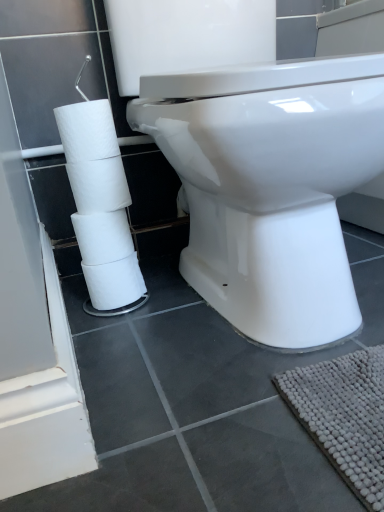
At what (x,y) coordinates should I click in order to perform the action: click on white glossy toilet at center. Please return your answer as a coordinate pair (x, y). Looking at the image, I should click on (271, 187).

The height and width of the screenshot is (512, 384). Describe the element at coordinates (271, 187) in the screenshot. I see `white glossy toilet at center` at that location.

Describe the element at coordinates (100, 205) in the screenshot. I see `white matte toilet paper at left` at that location.

Find the location of a particular element. This screenshot has width=384, height=512. white matte toilet paper at left is located at coordinates (100, 205).

What are the coordinates of `white glossy toilet at center` in the screenshot? It's located at (271, 187).

Which object is positioned more to the left, white glossy toilet at center or white matte toilet paper at left?

white matte toilet paper at left is more to the left.

In the image, is white glossy toilet at center positioned in front of or behind white matte toilet paper at left?

In the image, white glossy toilet at center appears in front of white matte toilet paper at left.

Is point (267, 111) positioned behind point (64, 118)?

That is False.

From the image's perspective, is white glossy toilet at center on white matte toilet paper at left?

Yes, from the image's perspective, white glossy toilet at center is above white matte toilet paper at left.

From a real-world perspective, which is physically above, white glossy toilet at center or white matte toilet paper at left?

In real-world perspective, white glossy toilet at center is above.

Which object is thinner, white glossy toilet at center or white matte toilet paper at left?

With smaller width is white matte toilet paper at left.

Between white glossy toilet at center and white matte toilet paper at left, which one has more height?

With more height is white glossy toilet at center.

Between white glossy toilet at center and white matte toilet paper at left, which one has smaller size?

white matte toilet paper at left.

From the picture: Is white glossy toilet at center not within white matte toilet paper at left?

Yes, white glossy toilet at center is located beyond the bounds of white matte toilet paper at left.

Does white glossy toilet at center touch white matte toilet paper at left?

No, white glossy toilet at center is not making contact with white matte toilet paper at left.

Is white glossy toilet at center positioned with its back to white matte toilet paper at left?

That's not correct — white glossy toilet at center is not looking away from white matte toilet paper at left.

How different are the orientations of white glossy toilet at center and white matte toilet paper at left in degrees?

There is a 2.61-degree angle between the facing directions of white glossy toilet at center and white matte toilet paper at left.

Identify the location of toilet paper that is below the white glossy toilet at center (from the image's perspective). This screenshot has height=512, width=384. (100, 205).

Which is more to the left, white matte toilet paper at left or white glossy toilet at center?

white matte toilet paper at left.

Is the position of white matte toilet paper at left more distant than that of white glossy toilet at center?

Yes, it is behind white glossy toilet at center.

Considering the points (124, 298) and (207, 116), which point is behind, point (124, 298) or point (207, 116)?

The point (124, 298) is more distant.

Looking at this image, from the image's perspective, is white matte toilet paper at left located above or below white glossy toilet at center?

Clearly, from the image's perspective, white matte toilet paper at left is below white glossy toilet at center.

From a real-world perspective, which is physically below, white matte toilet paper at left or white glossy toilet at center?

From a 3D spatial view, white matte toilet paper at left is below.

Considering the sizes of objects white matte toilet paper at left and white glossy toilet at center in the image provided, who is wider, white matte toilet paper at left or white glossy toilet at center?

With larger width is white glossy toilet at center.

Between white matte toilet paper at left and white glossy toilet at center, which one has more height?

white glossy toilet at center is taller.

Can you confirm if white matte toilet paper at left is bigger than white glossy toilet at center?

Incorrect, white matte toilet paper at left is not larger than white glossy toilet at center.

Choose the correct answer: Is white matte toilet paper at left inside white glossy toilet at center or outside it?

The correct answer is: outside.

Is there a large distance between white matte toilet paper at left and white glossy toilet at center?

Actually, white matte toilet paper at left and white glossy toilet at center are a little close together.

Is white matte toilet paper at left facing away from white glossy toilet at center?

white matte toilet paper at left is not turned away from white glossy toilet at center.

Where is `toilet paper lying below the white glossy toilet at center (from the image's perspective)`? This screenshot has height=512, width=384. toilet paper lying below the white glossy toilet at center (from the image's perspective) is located at coordinates (100, 205).

Where is `toilet paper that is behind the white glossy toilet at center`? toilet paper that is behind the white glossy toilet at center is located at coordinates (100, 205).

Where is `toilet paper that appears below the white glossy toilet at center (from the image's perspective)`? Image resolution: width=384 pixels, height=512 pixels. toilet paper that appears below the white glossy toilet at center (from the image's perspective) is located at coordinates (100, 205).